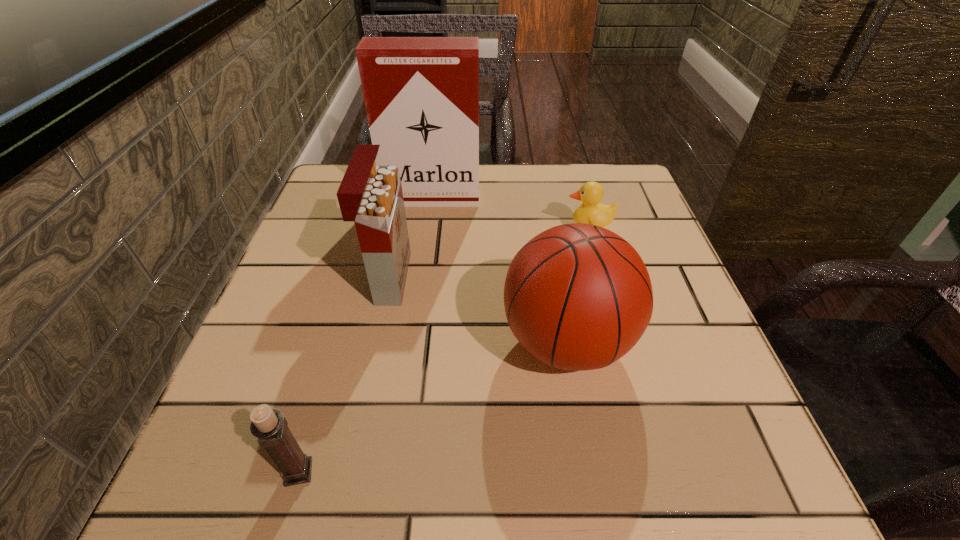
At what (x,y) coordinates should I click in order to perform the action: click on duckling that is at the right edge. Please return your answer as a coordinate pair (x, y). Looking at the image, I should click on (591, 193).

Locate an element on the screen. The image size is (960, 540). object that is at the far left corner is located at coordinates (421, 94).

This screenshot has width=960, height=540. Identify the location of object positioned at the near left corner. (269, 425).

In the image, there is a desktop. At what (x,y) coordinates should I click in order to perform the action: click on vacant space at the far edge. Please return your answer as a coordinate pair (x, y). The image size is (960, 540). Looking at the image, I should click on (523, 170).

Where is `free space at the left edge of the desktop`? free space at the left edge of the desktop is located at coordinates (240, 376).

Identify the location of free spot at the right edge of the desktop. This screenshot has height=540, width=960. (691, 384).

Image resolution: width=960 pixels, height=540 pixels. Identify the location of free space at the far left corner of the desktop. (337, 185).

At what (x,y) coordinates should I click in order to perform the action: click on free region at the far right corner of the desktop. Please return your answer as a coordinate pair (x, y). The image size is (960, 540). Looking at the image, I should click on (577, 170).

Where is `vacant region at the near right corner of the desktop`? vacant region at the near right corner of the desktop is located at coordinates (722, 450).

Find the location of a particular element. vacant area between the candle holder and the basketball is located at coordinates (432, 407).